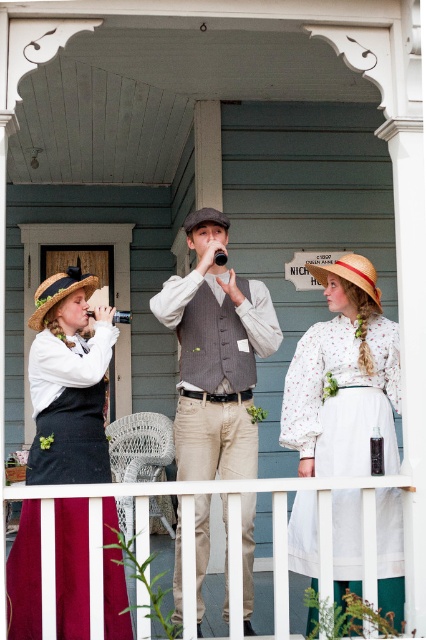
You are a photographer on the porch and want to place a small stool between the matte black hat at left and the gray wool vest at center. Based on their positions, where should you place the stool?

The matte black hat at left is to the left of the gray wool vest at center, so you should place the stool between them, closer to the center position between the two objects.